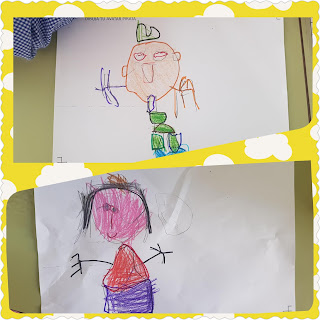
The width and height of the screenshot is (320, 320). In order to click on table in this screenshot , I will do `click(39, 89)`.